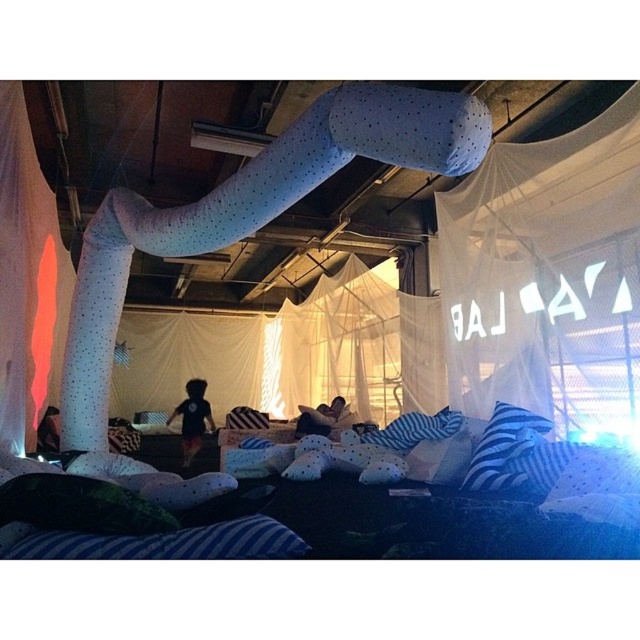
Question: Which object appears farthest from the camera in this image?

Choices:
 (A) blue striped pillow at lower left
 (B) matte black teddy bear at center
 (C) striped fabric bed at center

Answer: (B)

Question: Considering the real-world distances, which object is farthest from the blue striped pillow at lower left?

Choices:
 (A) blue striped pillow at center
 (B) striped fabric bed at center

Answer: (A)

Question: In this image, where is striped fabric bed at center located relative to blue striped pillow at lower left?

Choices:
 (A) above
 (B) below

Answer: (B)

Question: Does velvet green pillow at lower left appear under matte black teddy bear at center?

Choices:
 (A) yes
 (B) no

Answer: (B)

Question: Can you confirm if striped fabric bed at center is positioned to the right of white striped pillow at center?

Choices:
 (A) yes
 (B) no

Answer: (B)

Question: Which object is the closest to the black plush bear at center?

Choices:
 (A) translucent white fabric at left
 (B) blue striped pillow at lower left

Answer: (A)